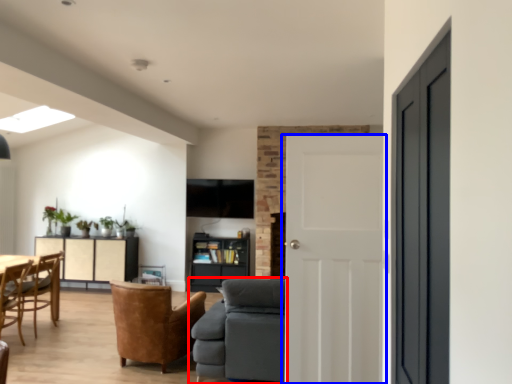
Question: Which object appears farthest to the camera in this image, studio couch (highlighted by a red box) or door (highlighted by a blue box)?

Choices:
 (A) studio couch
 (B) door

Answer: (A)